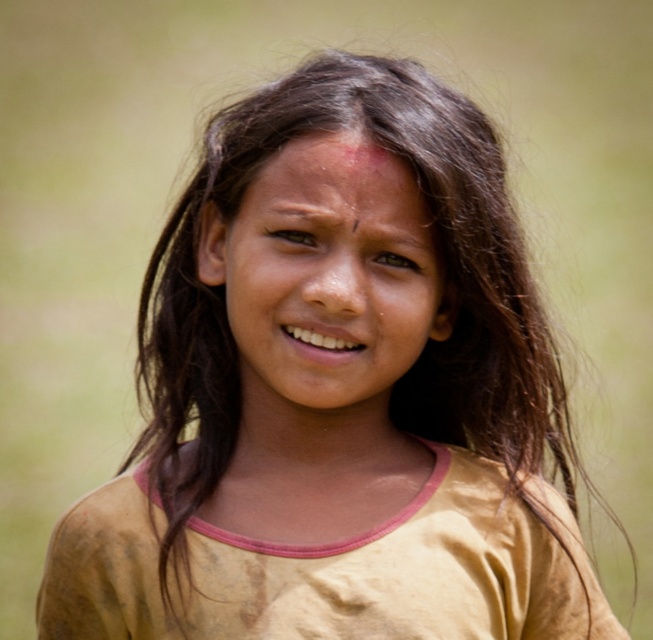
Based on the scene description, where is the smooth skin face at center located in terms of coordinates?

The smooth skin face at center is located at the coordinates point (326, 278).

In the scene shown: Based on the scene description, can you determine which part of the girl is closer to the observer between her smooth skin face at center and smooth skin forehead at center?

The smooth skin face at center is in front of the smooth skin forehead at center, so the smooth skin face at center is closer to the observer.